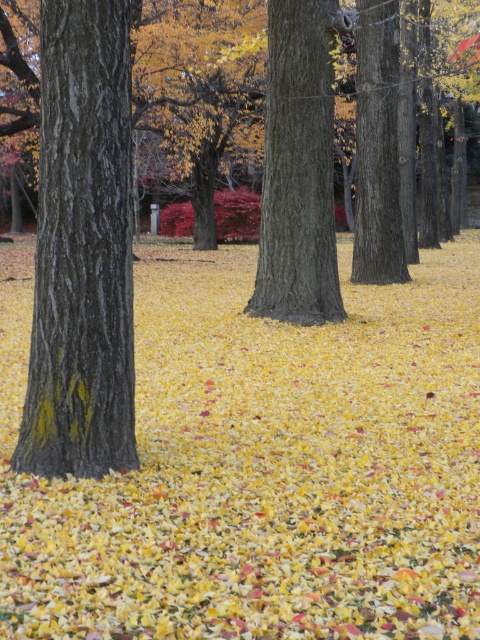
You are standing in the autumn scene and want to compare the two tree trunks in the center. Which one is wider? The options are the smooth brown tree trunk at center and the smooth bark tree at center.

The smooth brown tree trunk at center is wider than the smooth bark tree at center.

You are standing in the autumn scene and want to take a photo of the smooth bark tree at left. If your camera has a maximum focus range of 15 feet, will you need to move closer to get a clear shot?

The smooth bark tree at left is 17.44 feet away from the camera, which is beyond the maximum focus range of 15 feet. To get a clear photo, you need to move closer so that the distance becomes within 15 feet.